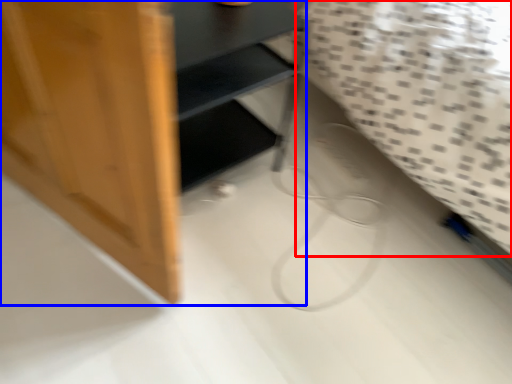
Question: Which of the following is the farthest to the observer, sheet (highlighted by a red box) or furniture (highlighted by a blue box)?

Choices:
 (A) sheet
 (B) furniture

Answer: (B)